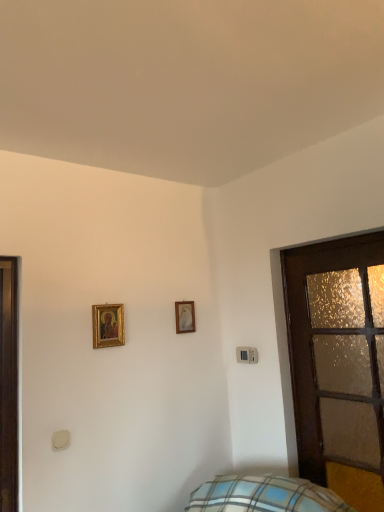
Question: Considering their positions, is gold-framed picture at upper center, the 1th picture frame in the right-to-left sequence, located in front of or behind gold-framed picture at upper left, the 2th picture frame positioned from the right?

Choices:
 (A) behind
 (B) front

Answer: (A)

Question: Considering the positions of gold-framed picture at upper center, the 1th picture frame in the right-to-left sequence, and gold-framed picture at upper left, the first picture frame when ordered from front to back, in the image, is gold-framed picture at upper center, the 1th picture frame in the right-to-left sequence, bigger or smaller than gold-framed picture at upper left, the first picture frame when ordered from front to back,?

Choices:
 (A) small
 (B) big

Answer: (A)

Question: Estimate the real-world distances between objects in this image. Which object is farther from the gold-framed picture at upper left, the first picture frame when ordered from front to back?

Choices:
 (A) gold-framed picture at upper center, which is counted as the first picture frame, starting from the back
 (B) wooden frosted glass door at right

Answer: (B)

Question: Which of these objects is positioned farthest from the gold-framed picture at upper left, which is the 1th picture frame from left to right?

Choices:
 (A) wooden frosted glass door at right
 (B) gold-framed picture at upper center, the 2th picture frame viewed from the front

Answer: (A)